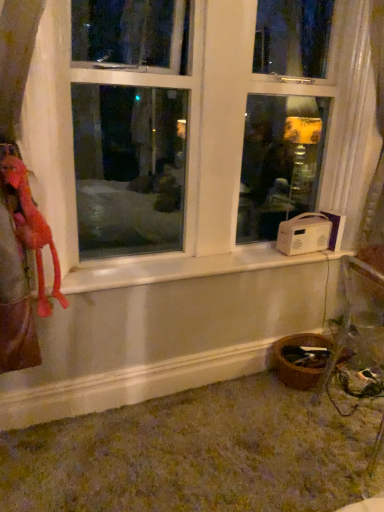
This screenshot has width=384, height=512. In order to click on vacant space underneath white plastic window at center (from a real-world perspective) in this screenshot , I will do `click(195, 265)`.